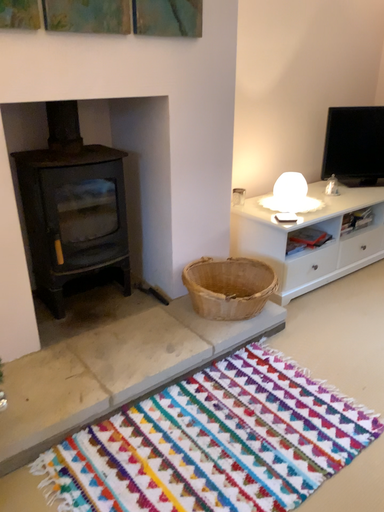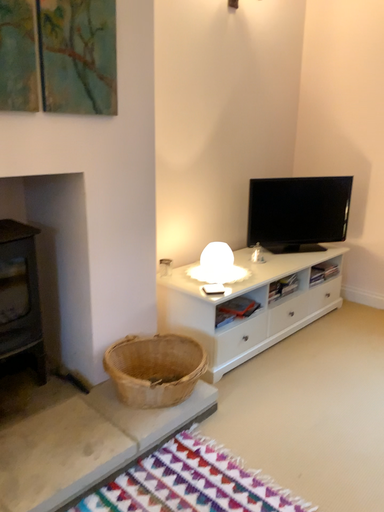
Question: How did the camera likely rotate when shooting the video?

Choices:
 (A) rotated upward
 (B) rotated downward

Answer: (A)